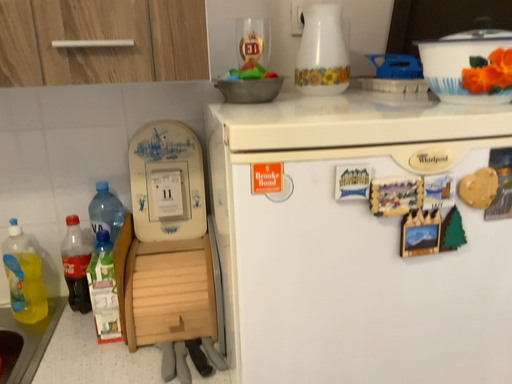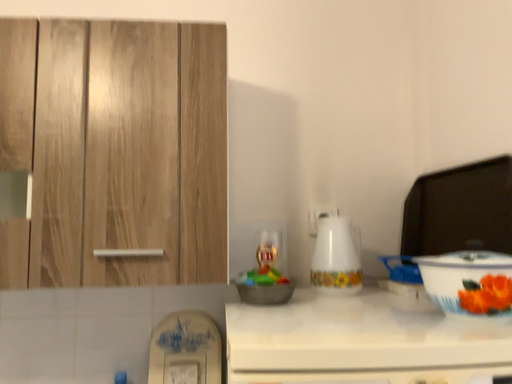
Question: How did the camera likely rotate when shooting the video?

Choices:
 (A) rotated downward
 (B) rotated upward

Answer: (B)